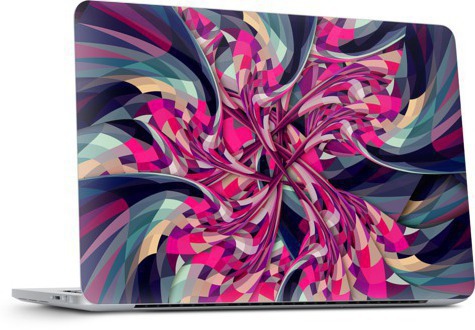
The width and height of the screenshot is (475, 330). I want to click on plug in area, so click(x=56, y=300).